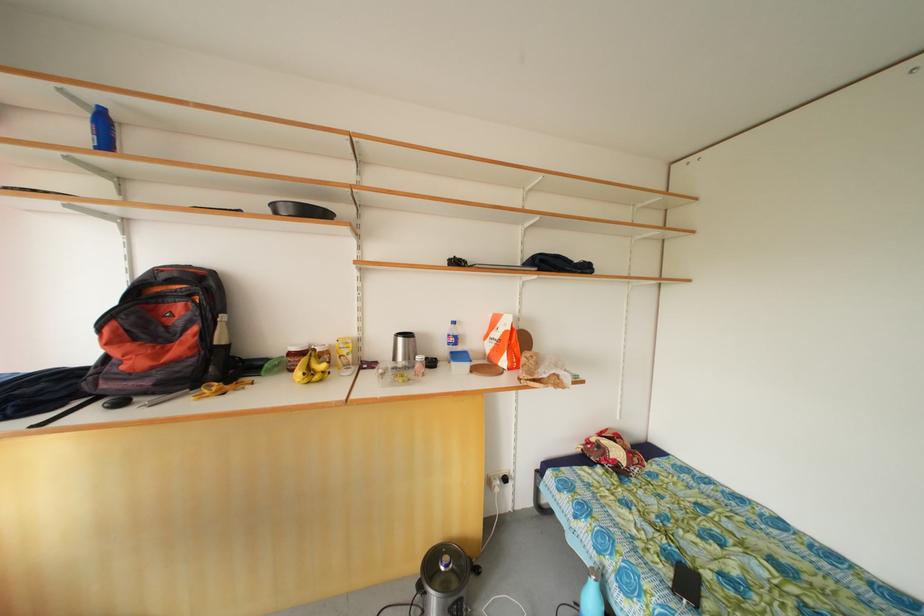
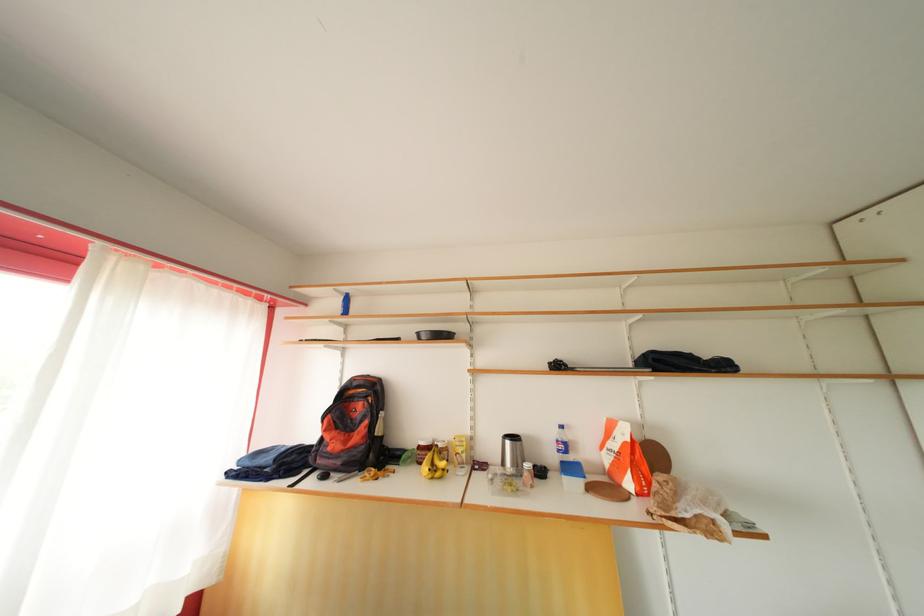
In the second image, find the point that corresponds to point (448, 355) in the first image.

(558, 463)